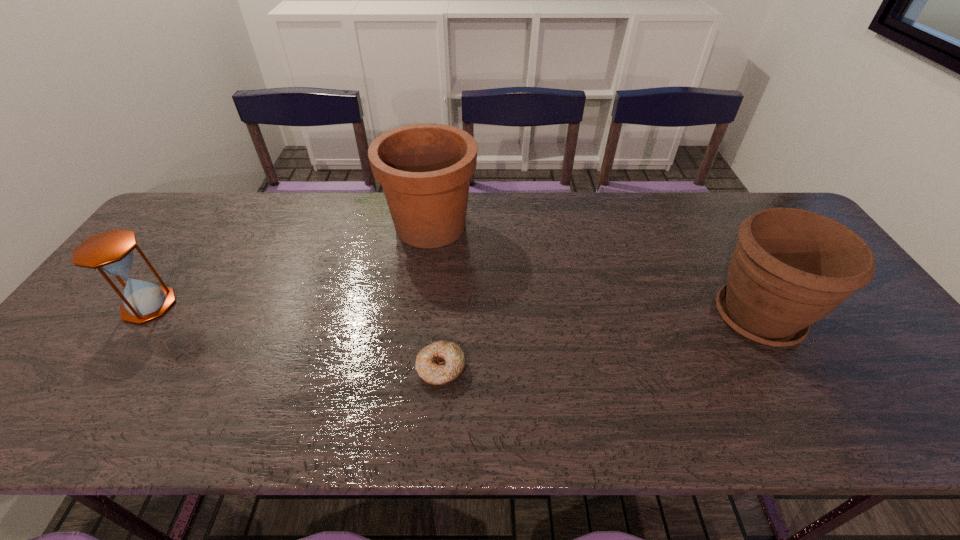
The height and width of the screenshot is (540, 960). I want to click on vacant space that's between the hourglass and the shortest object, so click(296, 337).

You are a GUI agent. You are given a task and a screenshot of the screen. Output one action in this format:
    pyautogui.click(x=<x>, y=<y>)
    Task: Click on the vacant space in between the nearer flowerpot and the shortest object
    This screenshot has width=960, height=540.
    Given the screenshot: What is the action you would take?
    pyautogui.click(x=600, y=343)

In order to click on free spot between the farther flowerpot and the second shortest object in this screenshot , I will do `click(290, 266)`.

Locate an element on the screen. empty space that is in between the farthest object and the doughnut is located at coordinates (436, 298).

This screenshot has width=960, height=540. I want to click on vacant point located between the right flowerpot and the hourglass, so click(x=453, y=311).

The image size is (960, 540). What are the coordinates of `free space between the farther flowerpot and the hourglass` in the screenshot? It's located at (290, 266).

At what (x,y) coordinates should I click in order to perform the action: click on vacant space that is in between the hourglass and the left flowerpot. Please return your answer as a coordinate pair (x, y). This screenshot has width=960, height=540. Looking at the image, I should click on (290, 266).

The image size is (960, 540). Find the location of `vacant space that's between the shortest object and the farthest object`. vacant space that's between the shortest object and the farthest object is located at coordinates (436, 298).

Locate which object ranks in proximity to the shortest object. Please provide its 2D coordinates. Your answer should be formatted as a tuple, i.e. [(x, y)], where the tuple contains the x and y coordinates of a point satisfying the conditions above.

[(424, 169)]

You are a GUI agent. You are given a task and a screenshot of the screen. Output one action in this format:
    pyautogui.click(x=<x>, y=<y>)
    Task: Click on the object that is the second nearest to the second shortest object
    This screenshot has width=960, height=540.
    Given the screenshot: What is the action you would take?
    pyautogui.click(x=441, y=362)